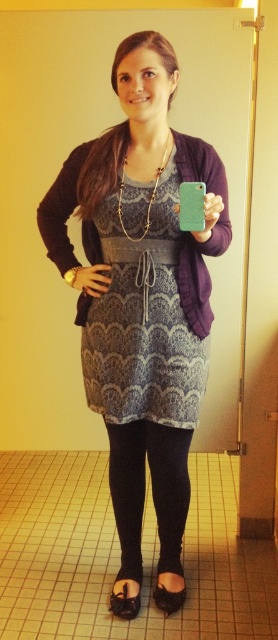
Which is in front, point (122, 600) or point (162, 608)?

Point (162, 608) is in front.

Is point (125, 609) less distant than point (177, 592)?

Yes, it is in front of point (177, 592).

The height and width of the screenshot is (640, 278). What are the coordinates of `black suede sandal at lower center` in the screenshot? It's located at (123, 604).

Can you confirm if blue textured dress at center is wider than black suede sandal at lower center?

Yes.

Between point (139, 387) and point (122, 604), which one is positioned in front?

Point (139, 387)

Identify the location of blue textured dress at center. (142, 316).

The width and height of the screenshot is (278, 640). Find the location of `blue textured dress at center`. blue textured dress at center is located at coordinates (142, 316).

How much distance is there between purple knit cardigan at center and black fabric sandal at lower center?

purple knit cardigan at center and black fabric sandal at lower center are 3.86 feet apart.

Is purple knit cardigan at center below black fabric sandal at lower center?

No, purple knit cardigan at center is not below black fabric sandal at lower center.

Who is more distant from viewer, (80, 170) or (170, 604)?

Point (170, 604)

The width and height of the screenshot is (278, 640). In order to click on purple knit cardigan at center in this screenshot , I will do `click(192, 236)`.